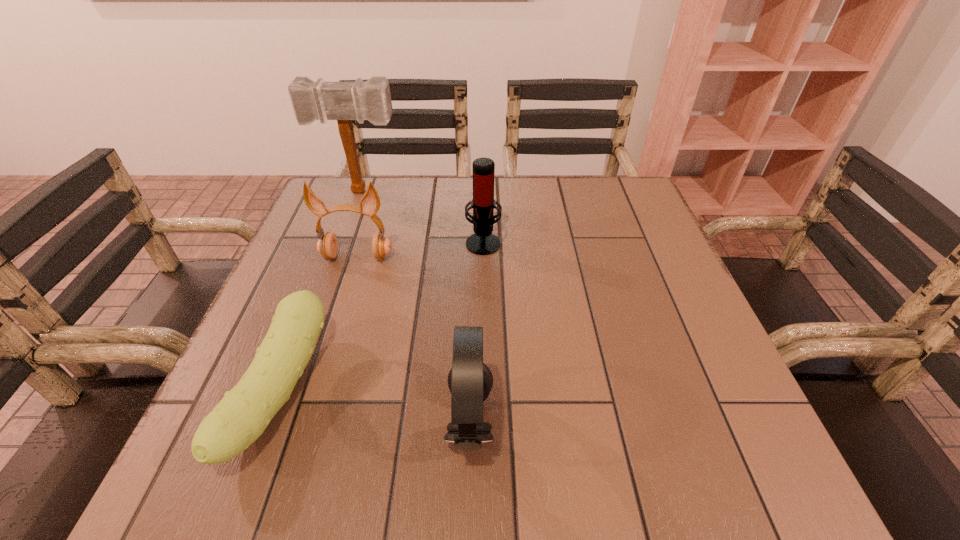
I want to click on vacant position at the left edge of the desktop, so pos(247,340).

Image resolution: width=960 pixels, height=540 pixels. In order to click on free location at the right edge of the desktop in this screenshot , I will do `click(613, 295)`.

Where is `blank space at the far left corner of the desktop`? blank space at the far left corner of the desktop is located at coordinates (344, 188).

Where is `vacant space that's between the farthest object and the microphone`? The width and height of the screenshot is (960, 540). vacant space that's between the farthest object and the microphone is located at coordinates (422, 217).

Find the location of `free spot between the nearer earphone and the cucumber`. free spot between the nearer earphone and the cucumber is located at coordinates (375, 408).

I want to click on empty space that is in between the tallest object and the microphone, so click(x=422, y=217).

Where is `free space between the microphone and the shortest object`? The width and height of the screenshot is (960, 540). free space between the microphone and the shortest object is located at coordinates (382, 317).

Find the location of a particular element. The height and width of the screenshot is (540, 960). free area in between the microphone and the shortest object is located at coordinates (382, 317).

Find the location of `vacant space that is in between the nearer earphone and the farther earphone`. vacant space that is in between the nearer earphone and the farther earphone is located at coordinates (414, 340).

The height and width of the screenshot is (540, 960). Find the location of `free space between the cucumber and the microphone`. free space between the cucumber and the microphone is located at coordinates (382, 317).